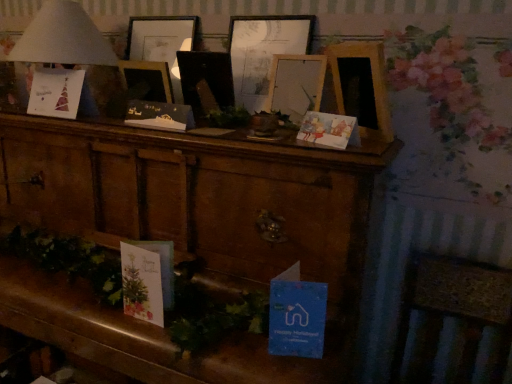
The image size is (512, 384). I want to click on vacant space in front of matte paper card at center right, placed as the third christmas card when sorted from back to front, so click(x=332, y=153).